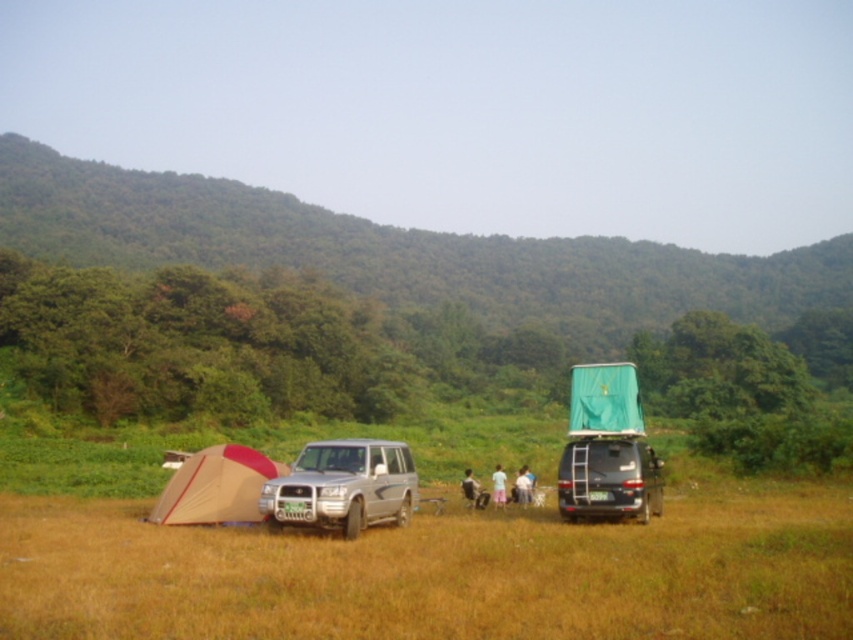
You are planning to set up a picnic blanket between the beige fabric tent at lower left and the light brown fabric person at center. The picnic blanket is 10 feet long. Will there be enough space between them to place the blanket end to end?

The distance between the beige fabric tent at lower left and the light brown fabric person at center is 20.34 feet. Since the picnic blanket is 10 feet long, there is enough space to place it end to end between them.

You are planning to set up a tent in the camping area shown. You have a beige fabric tent at lower left and a light brown fabric person at center. Which object is wider?

The beige fabric tent at lower left might be wider than the light brown fabric person at center.

You are standing at the camera position in the camping scene. You want to take a photo of the brown fabric tent at lower left. Is the tent within the camera frame if the camera has a 5 meter range?

The brown fabric tent at lower left is 7.54 meters away from the camera position. Since the camera has a 5 meter range, the tent is outside of the camera frame.